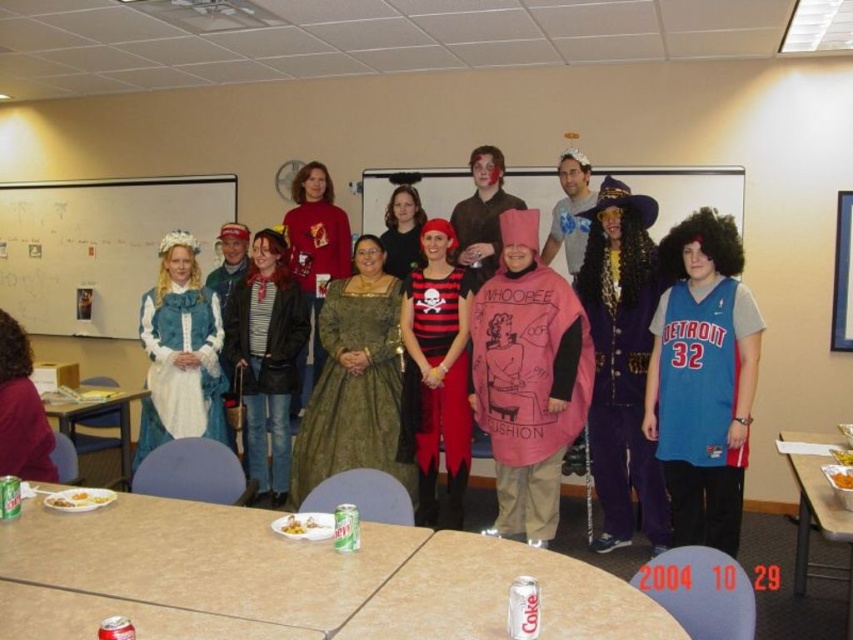
Between black matte dress at center and metallic silver tray at lower right, which one appears on the right side from the viewer's perspective?

From the viewer's perspective, metallic silver tray at lower right appears more on the right side.

Which is behind, point (427, 403) or point (817, 464)?

Point (427, 403)

Does point (466, 340) lie in front of point (804, 486)?

No, it is not.

Identify the location of black matte dress at center. (434, 390).

Is point (665, 634) less distant than point (525, 198)?

Yes, it is.

Which is below, metallic silver table at center or pink fabric hat at center?

metallic silver table at center is below.

Is point (602, 604) farther from camera compared to point (535, 189)?

No, it is not.

This screenshot has width=853, height=640. I want to click on metallic silver table at center, so click(502, 596).

Is pink fabric costume at center positioned behind matte white dress at lower left?

Yes, it is behind matte white dress at lower left.

Is pink fabric costume at center smaller than matte white dress at lower left?

No, pink fabric costume at center is not smaller than matte white dress at lower left.

You are a GUI agent. You are given a task and a screenshot of the screen. Output one action in this format:
    pyautogui.click(x=<x>, y=<y>)
    Task: Click on the pink fabric costume at center
    
    Given the screenshot: What is the action you would take?
    pyautogui.click(x=527, y=378)